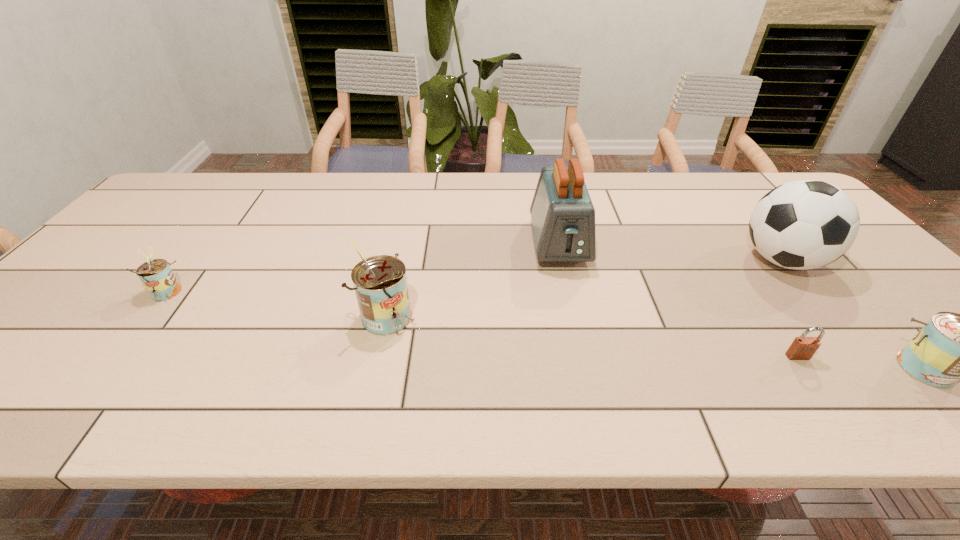
Where is `can present at the near edge`? The height and width of the screenshot is (540, 960). can present at the near edge is located at coordinates (380, 283).

Image resolution: width=960 pixels, height=540 pixels. In order to click on padlock that is at the near edge in this screenshot , I will do `click(802, 348)`.

Identify the location of object present at the right edge. (805, 224).

The height and width of the screenshot is (540, 960). I want to click on free space at the far edge of the desktop, so click(336, 177).

In the image, there is a desktop. Find the location of `vacant space at the near edge`. vacant space at the near edge is located at coordinates (383, 371).

You are a GUI agent. You are given a task and a screenshot of the screen. Output one action in this format:
    pyautogui.click(x=<x>, y=<y>)
    Task: Click on the free space at the left edge
    
    Given the screenshot: What is the action you would take?
    pyautogui.click(x=79, y=294)

The width and height of the screenshot is (960, 540). In the image, there is a desktop. What are the coordinates of `vacant space at the right edge` in the screenshot? It's located at (842, 289).

This screenshot has height=540, width=960. What are the coordinates of `vacant region at the far left corner of the desktop` in the screenshot? It's located at (203, 206).

I want to click on empty space between the soccer ball and the second object from left to right, so pyautogui.click(x=586, y=288).

Image resolution: width=960 pixels, height=540 pixels. In order to click on vacant space that is in between the padlock and the second can from right to left in this screenshot , I will do `click(593, 336)`.